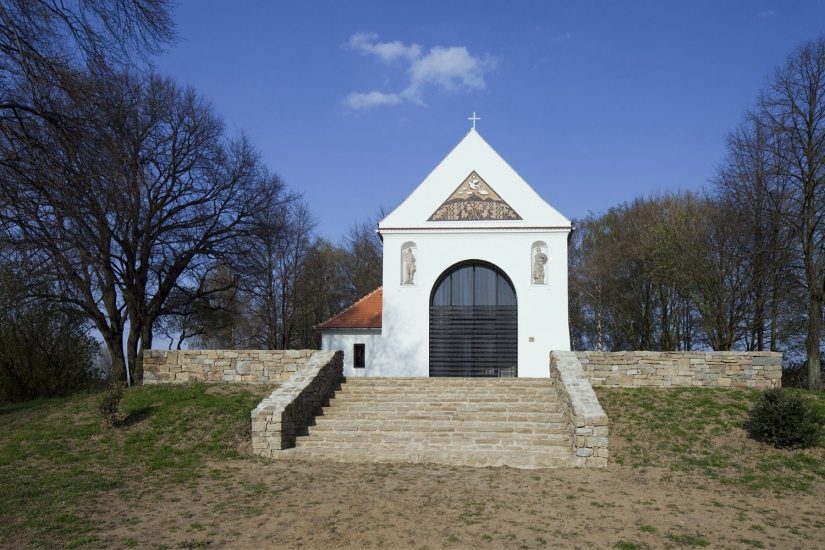
You are a GUI agent. You are given a task and a screenshot of the screen. Output one action in this format:
    pyautogui.click(x=<x>, y=<y>)
    Task: Click on the window
    The image size is (825, 550).
    Given the screenshot: What is the action you would take?
    pyautogui.click(x=361, y=351)